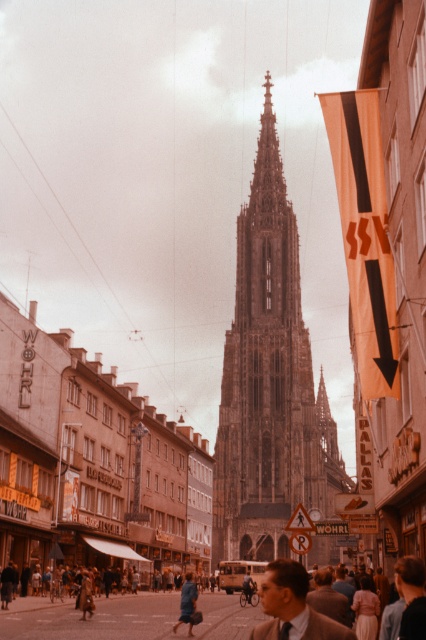
Question: Is brown stone tower at center wider than blue fabric coat at lower center?

Choices:
 (A) no
 (B) yes

Answer: (B)

Question: Which object is positioned farthest from the blue fabric coat at lower center?

Choices:
 (A) dark blue fabric coat at center
 (B) matte brown suit at center
 (C) brown stone tower at center

Answer: (C)

Question: Does matte brown suit at center appear under dark blue fabric coat at center?

Choices:
 (A) yes
 (B) no

Answer: (B)

Question: Estimate the real-world distances between objects in this image. Which object is closer to the dark blue fabric coat at center?

Choices:
 (A) brown stone tower at center
 (B) blue fabric coat at lower center
 (C) matte brown suit at center

Answer: (B)

Question: Which point appears farthest from the camera in this image?

Choices:
 (A) (80, 589)
 (B) (187, 588)
 (C) (325, 625)

Answer: (A)

Question: In this image, where is brown stone tower at center located relative to matte brown suit at center?

Choices:
 (A) right
 (B) left

Answer: (A)